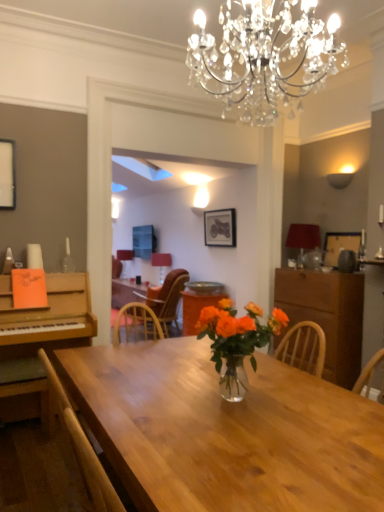
Question: Is translucent glass vase at center wider than wooden chair at center, the 1th chair from the back?

Choices:
 (A) no
 (B) yes

Answer: (A)

Question: Is translucent glass vase at center positioned before wooden chair at center, arranged as the second chair when viewed from the left?

Choices:
 (A) yes
 (B) no

Answer: (A)

Question: Is translucent glass vase at center thinner than wooden chair at center, the second chair when ordered from front to back?

Choices:
 (A) no
 (B) yes

Answer: (B)

Question: Does translucent glass vase at center have a larger size compared to wooden chair at center, which is the 1th chair from right to left?

Choices:
 (A) yes
 (B) no

Answer: (B)

Question: Is translucent glass vase at center taller than wooden chair at center, arranged as the second chair when viewed from the left?

Choices:
 (A) no
 (B) yes

Answer: (A)

Question: Can wooden chair at center, the second chair when ordered from front to back, be found inside translucent glass vase at center?

Choices:
 (A) yes
 (B) no

Answer: (B)

Question: Does wooden chair at center, which is the 1th chair from right to left, lie behind translucent glass vase at center?

Choices:
 (A) yes
 (B) no

Answer: (A)

Question: From the image's perspective, would you say wooden chair at center, arranged as the second chair when viewed from the left, is shown under translucent glass vase at center?

Choices:
 (A) yes
 (B) no

Answer: (B)

Question: Is wooden chair at center, the 1th chair from the back, to the left of translucent glass vase at center from the viewer's perspective?

Choices:
 (A) yes
 (B) no

Answer: (A)

Question: Is wooden chair at center, the 1th chair from the back, closer to camera compared to translucent glass vase at center?

Choices:
 (A) no
 (B) yes

Answer: (A)

Question: Is wooden chair at center, the 1th chair from the back, with translucent glass vase at center?

Choices:
 (A) yes
 (B) no

Answer: (B)

Question: Does wooden chair at center, the 1th chair from the back, have a lesser width compared to translucent glass vase at center?

Choices:
 (A) no
 (B) yes

Answer: (A)

Question: Could you tell me if matte white lampshade at center, which ranks as the 1th lamp in left-to-right order, is turned towards matte red lampshade at center, which is the 2th lamp from back to front?

Choices:
 (A) yes
 (B) no

Answer: (B)